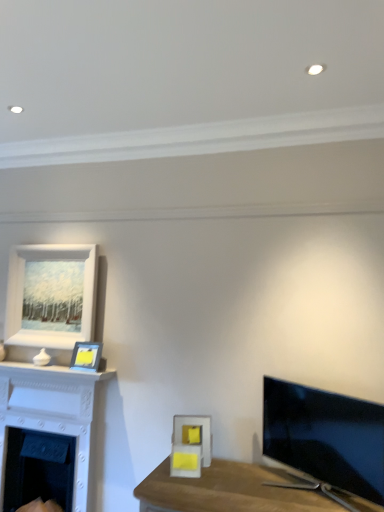
Where is `empty space that is ontop of white matte picture frame at upper left, marked as the third picture frame in a bottom-to-top arrangement (from a real-world perspective)`? This screenshot has height=512, width=384. empty space that is ontop of white matte picture frame at upper left, marked as the third picture frame in a bottom-to-top arrangement (from a real-world perspective) is located at coordinates (62, 243).